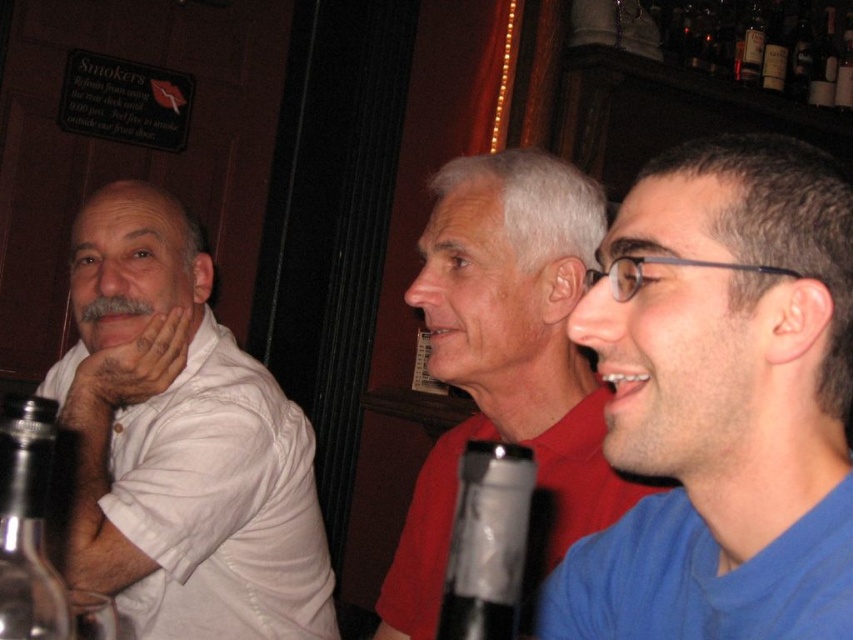
Question: Estimate the real-world distances between objects in this image. Which object is farther from the white matte shirt at left?

Choices:
 (A) dark glass bottle at upper right
 (B) blue fabric shirt at right
 (C) clear glass bottle at left
 (D) translucent glass bottle at center

Answer: (A)

Question: Which is nearer to the clear glass bottle at upper right?

Choices:
 (A) dark glass bottle at upper right
 (B) translucent glass bottle at center
 (C) white matte shirt at left
 (D) red matte shirt at center

Answer: (A)

Question: Does blue fabric shirt at right have a larger size compared to white matte shirt at left?

Choices:
 (A) no
 (B) yes

Answer: (A)

Question: Is translucent glass bottle at center to the left of clear glass bottle at left from the viewer's perspective?

Choices:
 (A) yes
 (B) no

Answer: (B)

Question: Can you confirm if blue fabric shirt at right is wider than translucent glass bottle at center?

Choices:
 (A) no
 (B) yes

Answer: (B)

Question: Estimate the real-world distances between objects in this image. Which object is closer to the dark glass bottle at upper right?

Choices:
 (A) blue fabric shirt at right
 (B) translucent glass bottle at center
 (C) clear glass bottle at left
 (D) clear glass bottle at upper right

Answer: (D)